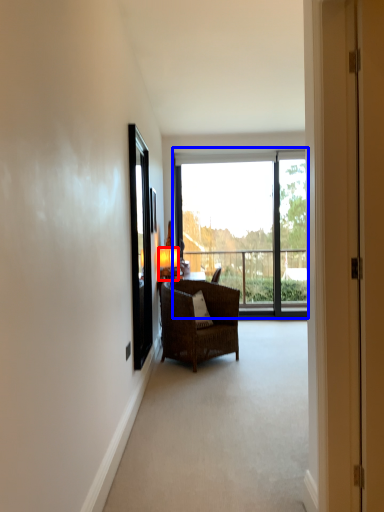
Question: Which object appears closest to the camera in this image, lamp (highlighted by a red box) or window (highlighted by a blue box)?

Choices:
 (A) lamp
 (B) window

Answer: (A)